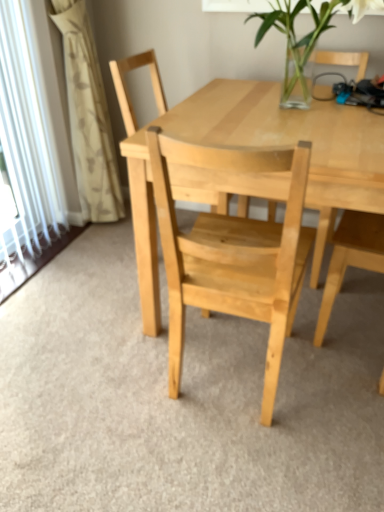
Image resolution: width=384 pixels, height=512 pixels. I want to click on free space to the left of natural wood chair at center, so click(x=100, y=266).